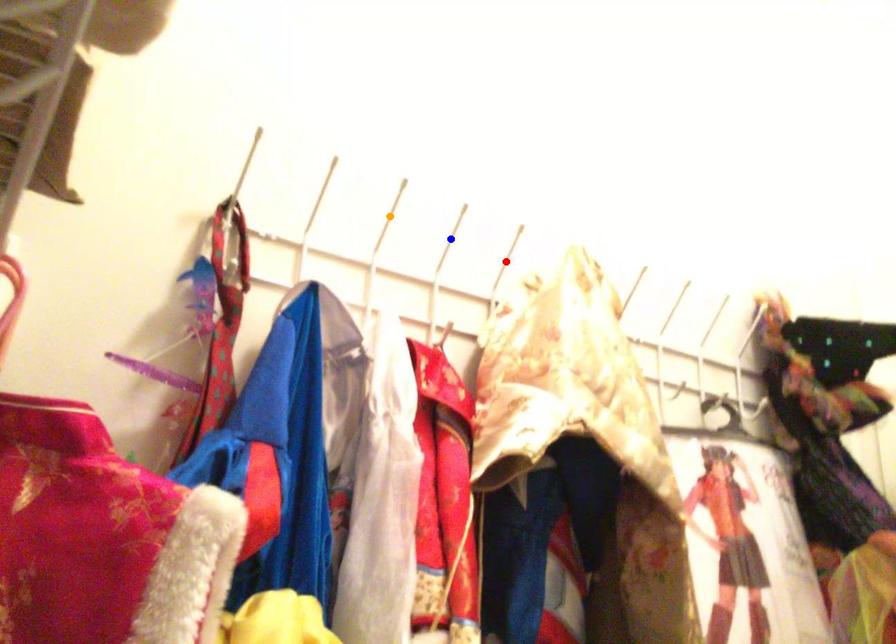
Order these from farthest to nearest:
1. blue point
2. red point
3. orange point

red point → blue point → orange point